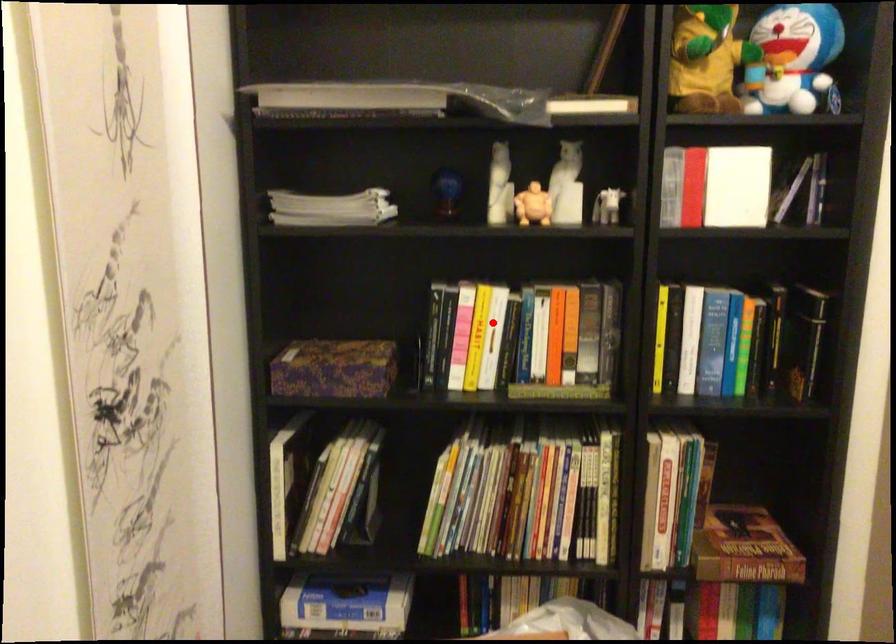
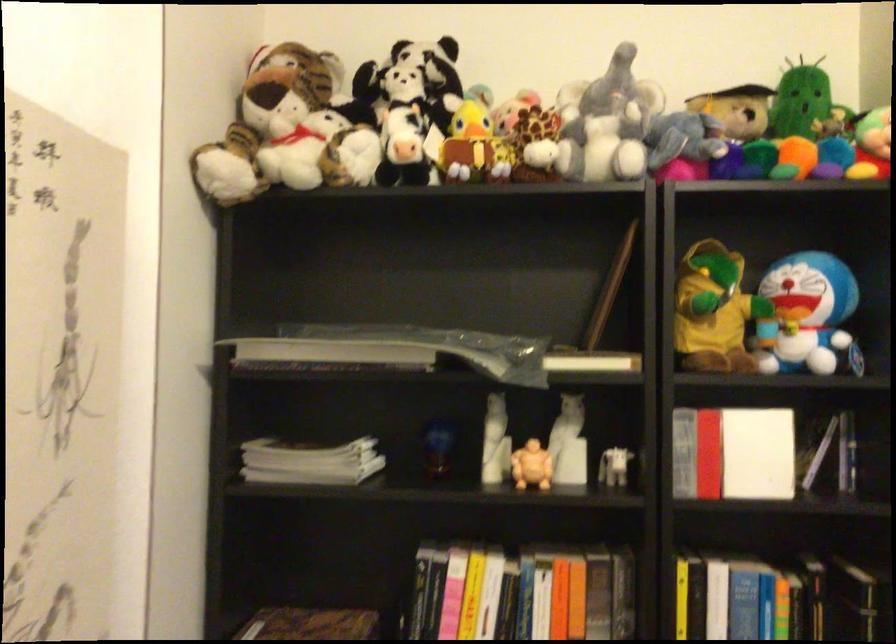
Question: I am providing you with two images of the same scene from different viewpoints. Image1 has a red point marked. In image2, the corresponding 3D location appears at what relative position? Reply with the corresponding letter.

Choices:
 (A) Closer
 (B) Farther

Answer: (A)